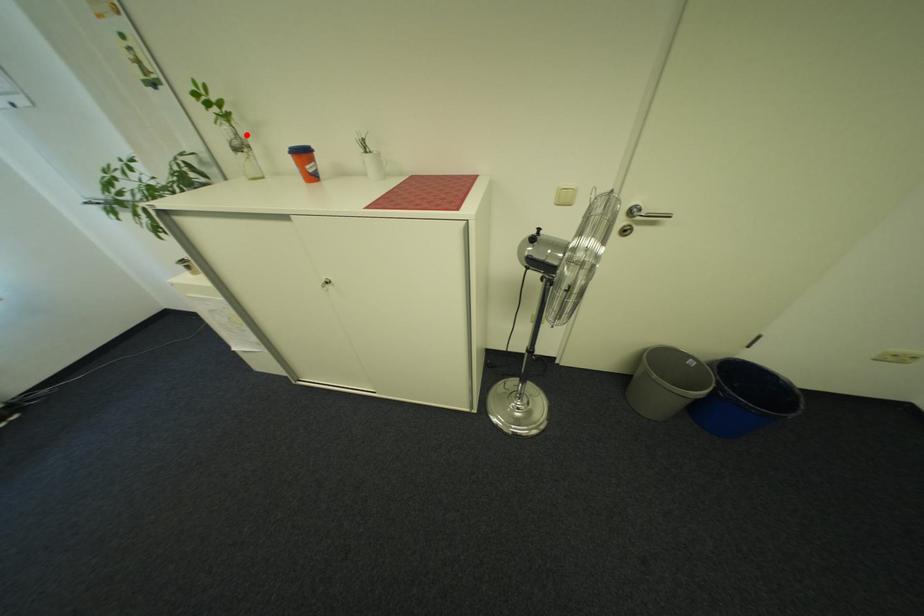
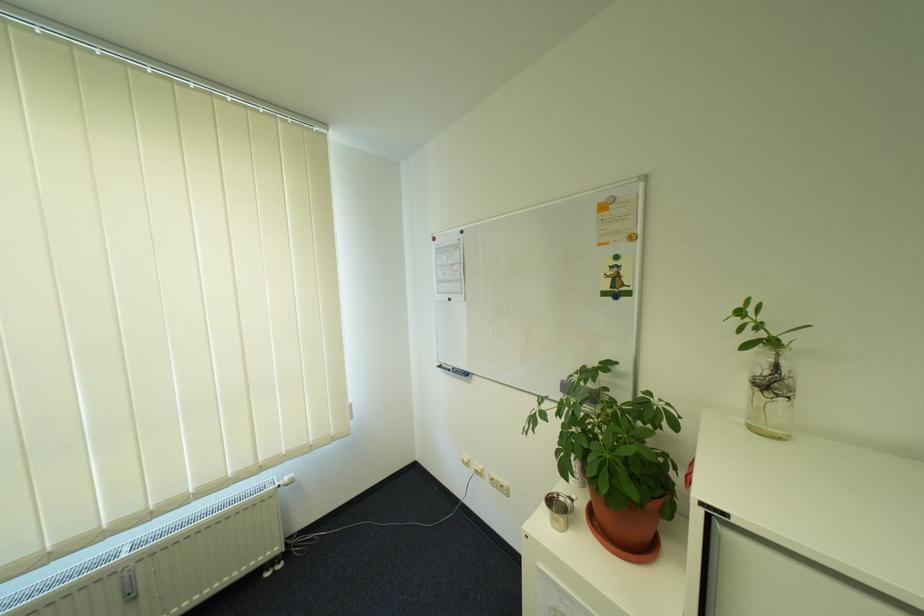
Locate, in the second image, the point that corresponds to the highlighted location in the first image.

(785, 369)